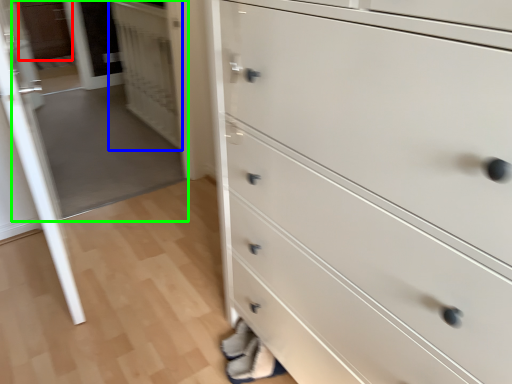
Question: Which object is the closest to the cabinetry (highlighted by a red box)? Choose among these: door (highlighted by a blue box) or glass door (highlighted by a green box).

Choices:
 (A) door
 (B) glass door

Answer: (B)